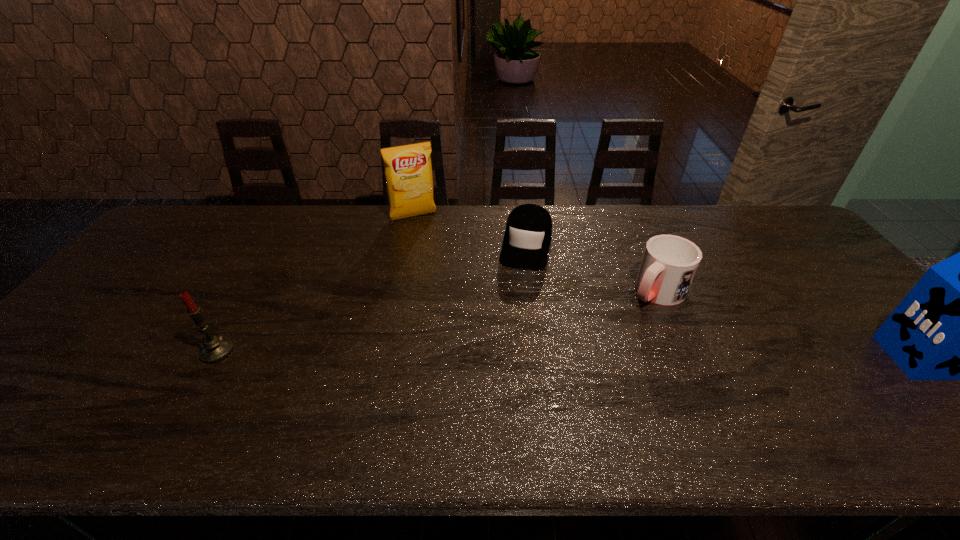
The width and height of the screenshot is (960, 540). In the image, there is a desktop. What are the coordinates of `vacant space at the far edge` in the screenshot? It's located at (452, 214).

Where is `free space at the near edge of the desktop`? The width and height of the screenshot is (960, 540). free space at the near edge of the desktop is located at coordinates (861, 384).

Locate an element on the screen. The image size is (960, 540). vacant area at the left edge is located at coordinates (126, 272).

In order to click on vacant space at the right edge of the desktop in this screenshot , I will do `click(816, 297)`.

What are the coordinates of `vacant space at the near left corner` in the screenshot? It's located at (64, 385).

The height and width of the screenshot is (540, 960). Identify the location of vacant space at the far right corner. (780, 216).

Identify the location of unoccupied position between the crisp (potato chip) and the shortest object. Image resolution: width=960 pixels, height=540 pixels. (469, 231).

Locate an element on the screen. vacant space that is in between the shortest object and the third shortest object is located at coordinates (372, 298).

The image size is (960, 540). In order to click on vacant space in between the fourth shortest object and the cap in this screenshot , I will do `click(469, 231)`.

Identify the location of vacant region between the second object from left to right and the third object from left to right. (469, 231).